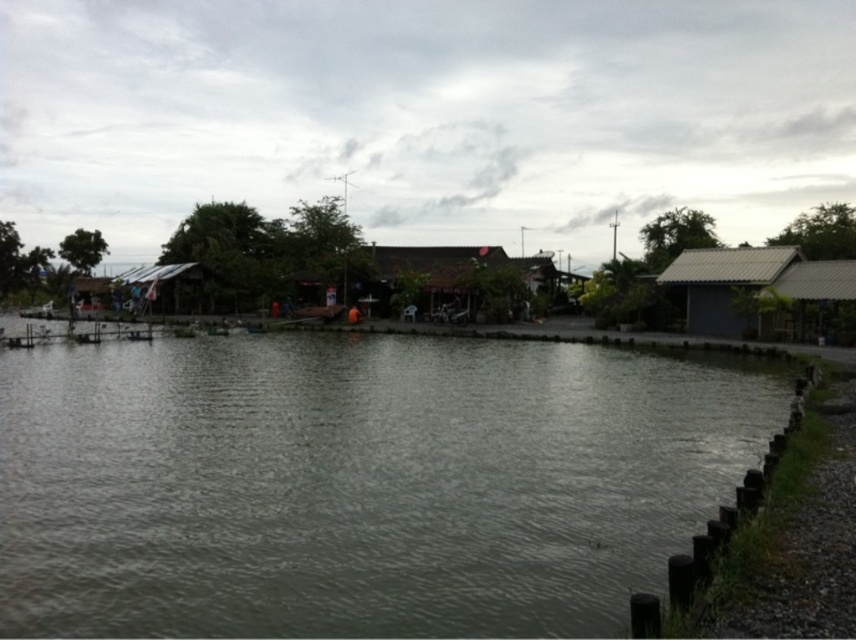
You are standing at the riverside and want to place a small boat between the two points marked as point (620, 352) and point (687, 317). Which point is closer to you, so you can position the boat correctly?

Point (620, 352) is closer to the viewer than point (687, 317), so you should position the boat closer to point (620, 352) to ensure it is near your current location.

You are standing at the edge of the riverside scene and want to find the gray water at center. According to the coordinates provided, where should you look relative to your position?

The gray water at center is located at coordinates 0.755 on the x axis and 0.421 on the y axis, so you should look towards the right and slightly upwards from your current position.